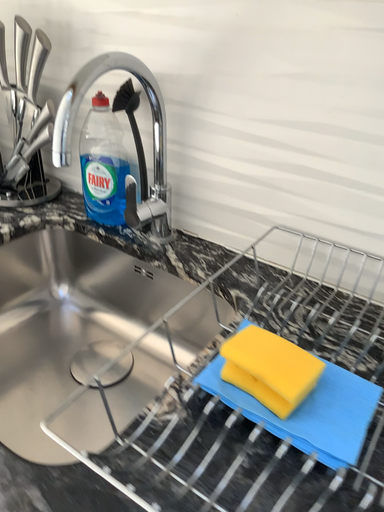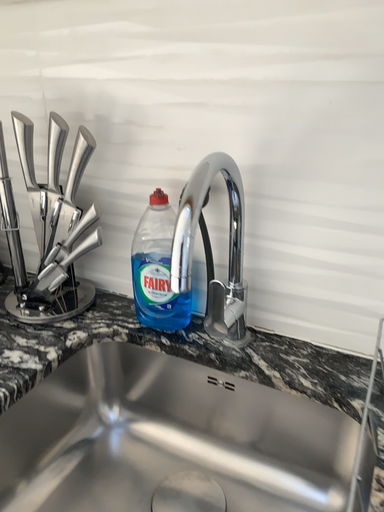
Question: How did the camera likely rotate when shooting the video?

Choices:
 (A) rotated downward
 (B) rotated upward

Answer: (B)